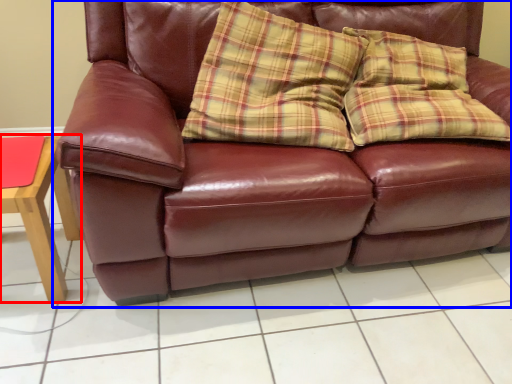
Question: Which object is closer to the camera taking this photo, table (highlighted by a red box) or studio couch (highlighted by a blue box)?

Choices:
 (A) table
 (B) studio couch

Answer: (B)